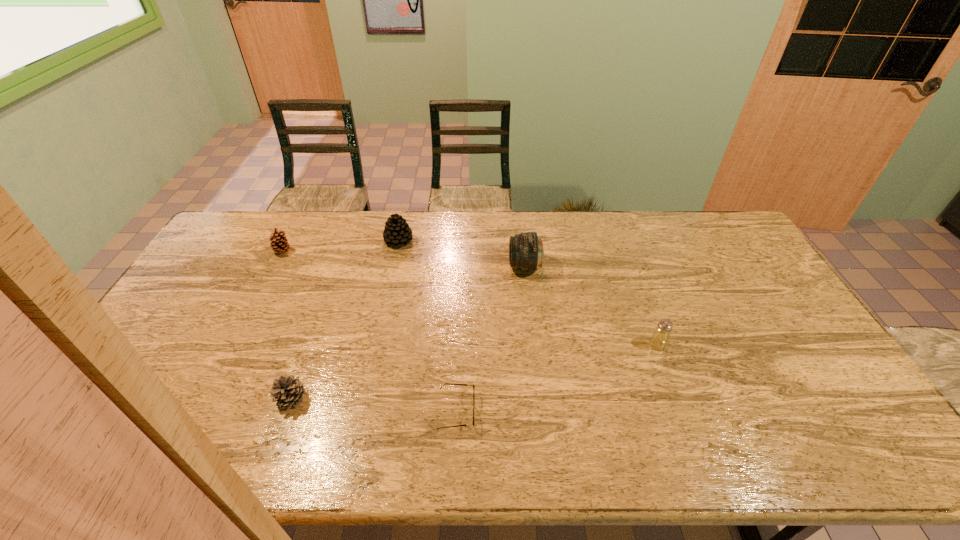
The height and width of the screenshot is (540, 960). Identify the location of free region at the near edge of the desktop. (328, 433).

In the image, there is a desktop. In order to click on vacant space at the left edge in this screenshot , I will do `click(169, 398)`.

Find the location of a particular element. free space at the far left corner of the desktop is located at coordinates (235, 220).

The width and height of the screenshot is (960, 540). In the image, there is a desktop. Find the location of `free space at the far right corner`. free space at the far right corner is located at coordinates (715, 214).

The width and height of the screenshot is (960, 540). I want to click on free space between the shortest pinecone and the rightmost pinecone, so click(x=345, y=320).

Where is `unoccupied area between the fifth object from left to right and the rightmost object`? This screenshot has width=960, height=540. unoccupied area between the fifth object from left to right and the rightmost object is located at coordinates (591, 306).

Identify the location of free space between the second object from left to right and the leftmost pinecone. (287, 325).

Find the location of a particular element. free area in between the fifth object from right to left and the third nearest object is located at coordinates (474, 372).

Where is `free point between the leftmost pinecone and the nearest pinecone`? This screenshot has height=540, width=960. free point between the leftmost pinecone and the nearest pinecone is located at coordinates (287, 325).

The height and width of the screenshot is (540, 960). In order to click on vacant space that is in between the third object from right to left and the saltshaker in this screenshot , I will do click(x=557, y=378).